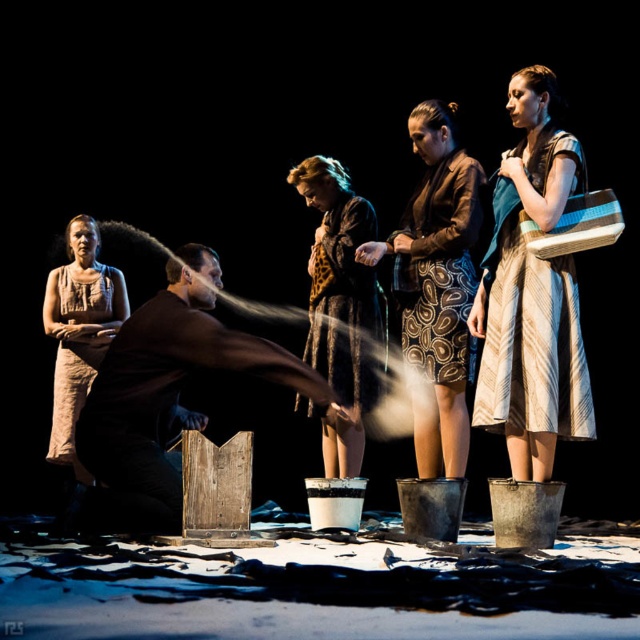
Does textured brown dress at center have a greater width compared to beige textured dress at left?

Yes.

Is textured brown dress at center to the right of beige textured dress at left from the viewer's perspective?

Yes, textured brown dress at center is to the right of beige textured dress at left.

Between point (304, 180) and point (68, 304), which one is positioned behind?

Positioned behind is point (68, 304).

I want to click on textured brown dress at center, so click(x=340, y=284).

Where is `brown textured skirt at center`? The height and width of the screenshot is (640, 640). brown textured skirt at center is located at coordinates (436, 285).

Is brown textured skirt at center further to the viewer compared to brown textured dress at center?

Yes, it is behind brown textured dress at center.

Where is `brown textured skirt at center`? Image resolution: width=640 pixels, height=640 pixels. brown textured skirt at center is located at coordinates (436, 285).

Can you confirm if striped fabric dress at right is bigger than brown textured dress at center?

Correct, striped fabric dress at right is larger in size than brown textured dress at center.

Is striped fabric dress at right wider than brown textured dress at center?

Indeed, striped fabric dress at right has a greater width compared to brown textured dress at center.

Between point (538, 99) and point (417, 362), which one is positioned in front?

Point (538, 99) is in front.

This screenshot has width=640, height=640. What are the coordinates of `striped fabric dress at right` in the screenshot? It's located at (531, 292).